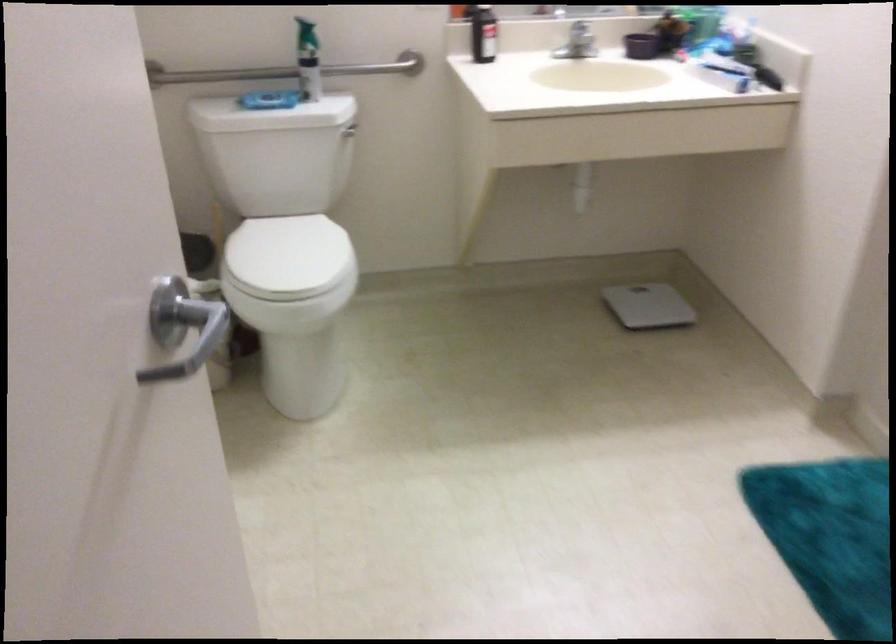
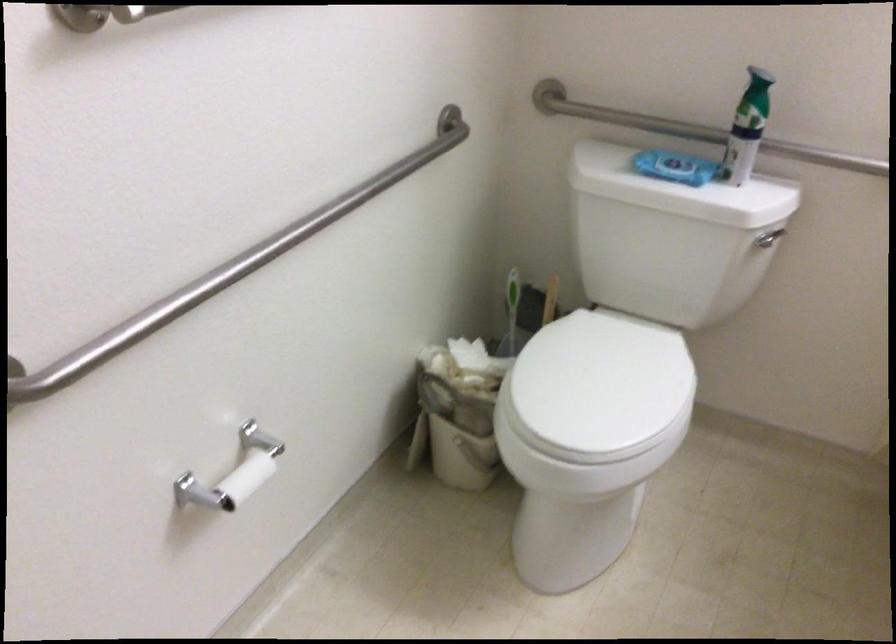
Locate, in the second image, the point that corresponds to the point at 276,100 in the first image.

(675, 167)